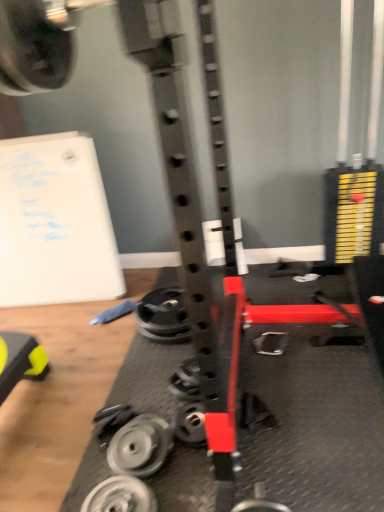
At what (x,y) coordinates should I click in order to perform the action: click on free space on the front side of metallic silver wheel at center, placed as the second wheel when sorted from back to front. Please return your answer as a coordinate pair (x, y). This screenshot has width=384, height=512. Looking at the image, I should click on (193, 475).